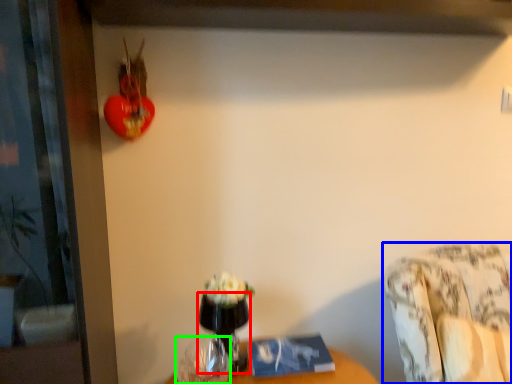
Question: Based on their relative distances, which object is farther from glass vase (highlighted by a red box)? Choose from furniture (highlighted by a blue box) and vase (highlighted by a green box).

Choices:
 (A) furniture
 (B) vase

Answer: (A)